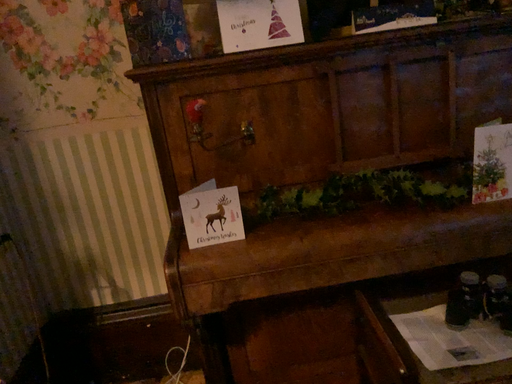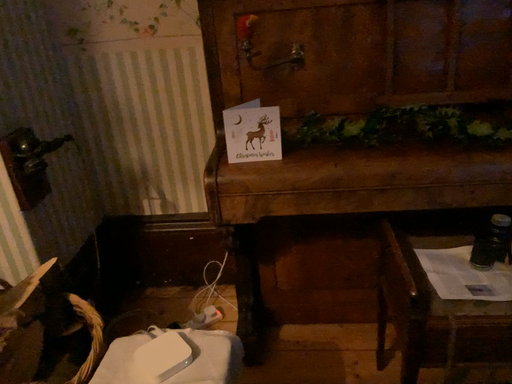
Question: Which way did the camera rotate in the video?

Choices:
 (A) rotated upward
 (B) rotated downward

Answer: (B)